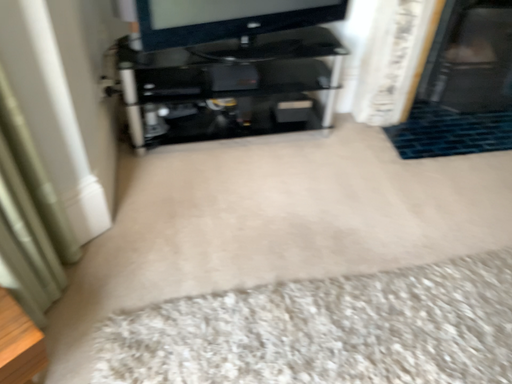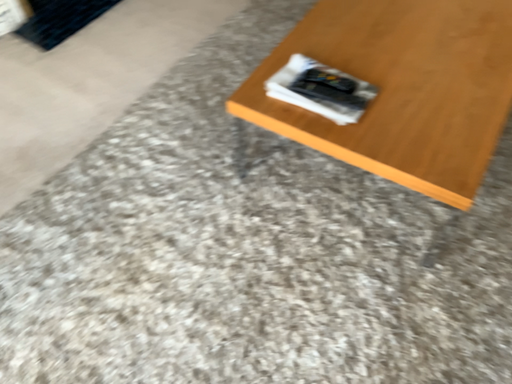
Question: Which way did the camera rotate in the video?

Choices:
 (A) rotated right
 (B) rotated left

Answer: (A)